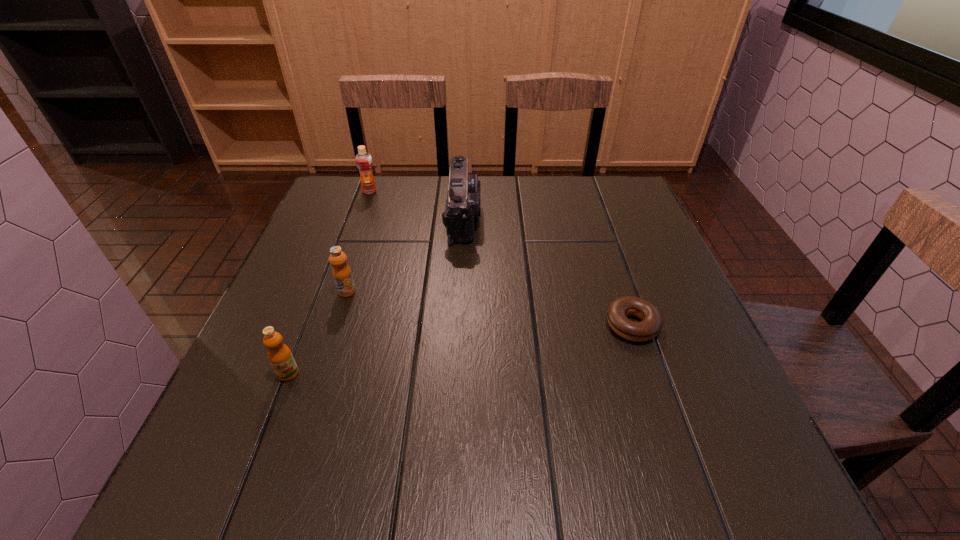
Locate an element on the screen. vacant space located 0.220m on the left of the fourth farthest object is located at coordinates (498, 325).

Identify the location of orange juice that is at the far edge. 363,159.

Find the location of `camcorder at the far edge`. camcorder at the far edge is located at coordinates (463, 204).

Where is `object at the right edge`? This screenshot has width=960, height=540. object at the right edge is located at coordinates (618, 310).

What are the coordinates of `object positioned at the far left corner` in the screenshot? It's located at (363, 159).

In the image, there is a desktop. Where is `free region at the far edge`? This screenshot has width=960, height=540. free region at the far edge is located at coordinates (486, 179).

This screenshot has width=960, height=540. Find the location of `vacant space at the near edge of the desktop`. vacant space at the near edge of the desktop is located at coordinates (314, 448).

Locate an element on the screen. The height and width of the screenshot is (540, 960). vacant space at the left edge is located at coordinates (368, 229).

I want to click on free space at the right edge of the desktop, so click(653, 303).

In the image, there is a desktop. At what (x,y) coordinates should I click in order to perform the action: click on vacant area at the far left corner. Please return your answer as a coordinate pair (x, y). This screenshot has width=960, height=540. Looking at the image, I should click on (334, 180).